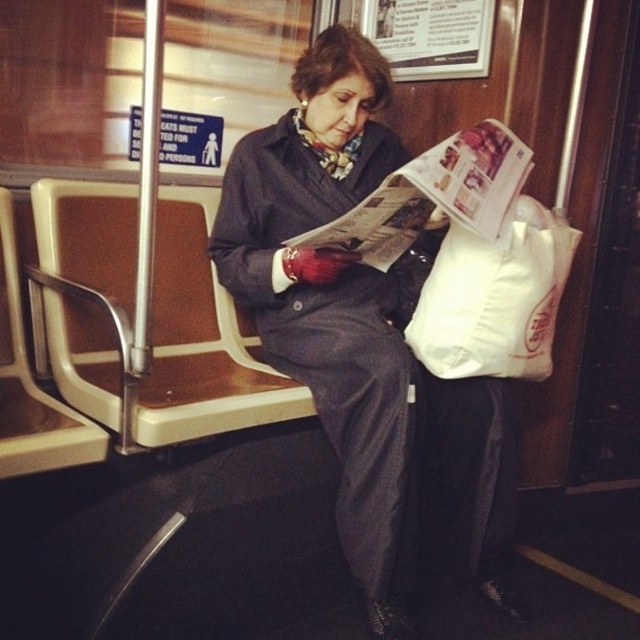
You are a passenger on the subway and see the matte black coat at center and the white paper bag at right. Which object is located lower in the scene?

The matte black coat at center is positioned under the white paper bag at right, so the coat is lower than the bag.

You are a passenger on the subway and see the matte black coat at center and the white paper bag at right. Which item is closer to the left side of the subway car?

The matte black coat at center is closer to the left side of the subway car because it is positioned to the left of the white paper bag at right.